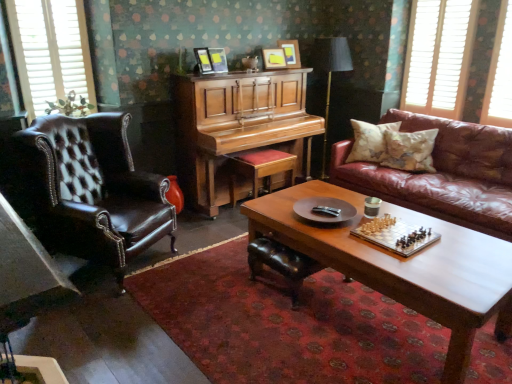
The width and height of the screenshot is (512, 384). Find the location of `empty space that is ontop of white wood window at upper left, arranged as the third window when viewed from the right (from a real-world perspective)`. empty space that is ontop of white wood window at upper left, arranged as the third window when viewed from the right (from a real-world perspective) is located at coordinates (51, 1).